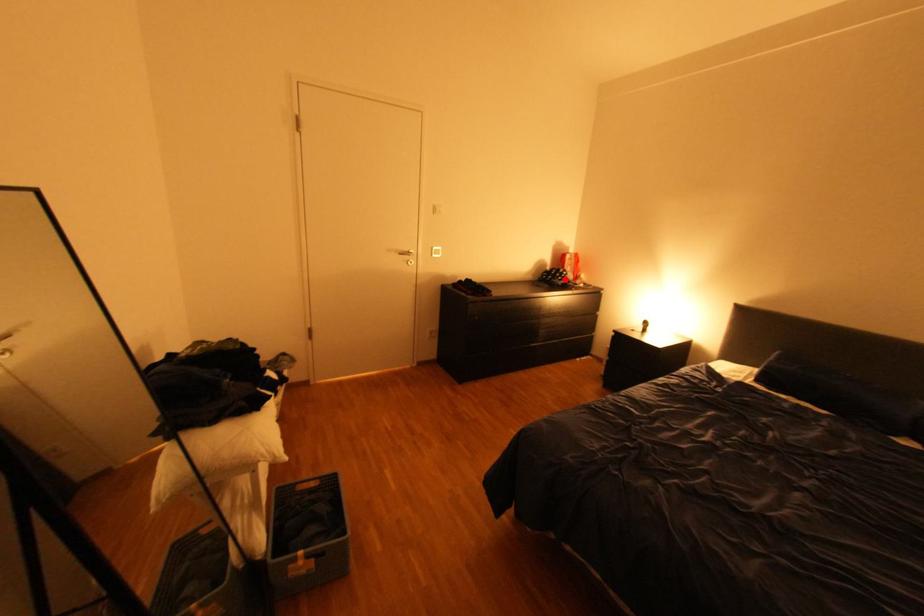
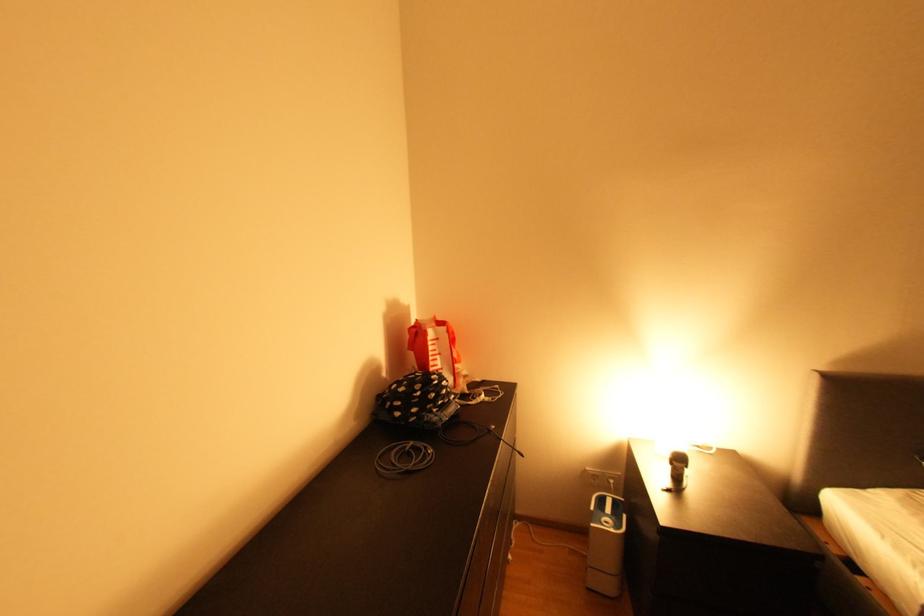
Find the pixel in the second image that matches the highlighted location in the first image.

(441, 411)